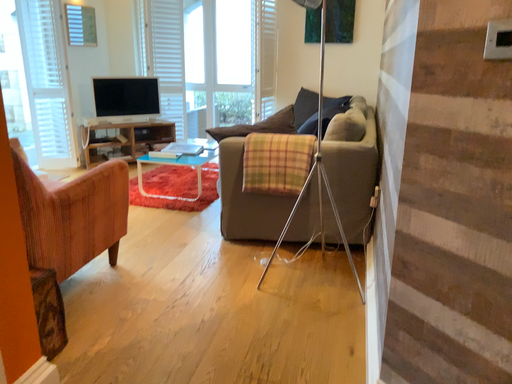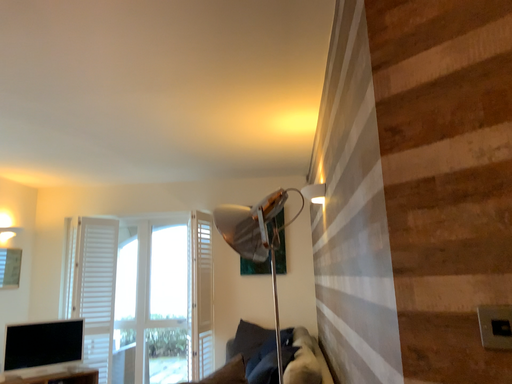
Question: How did the camera likely rotate when shooting the video?

Choices:
 (A) rotated left
 (B) rotated right

Answer: (B)